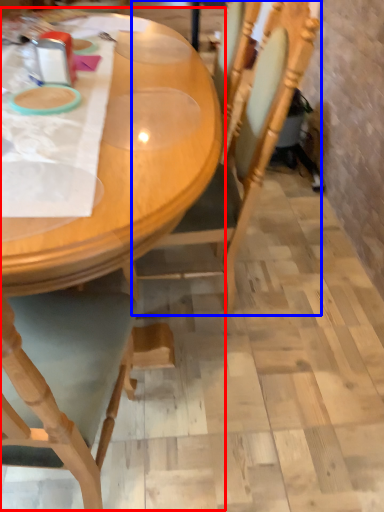
Question: Among these objects, which one is farthest to the camera, table (highlighted by a red box) or chair (highlighted by a blue box)?

Choices:
 (A) table
 (B) chair

Answer: (B)